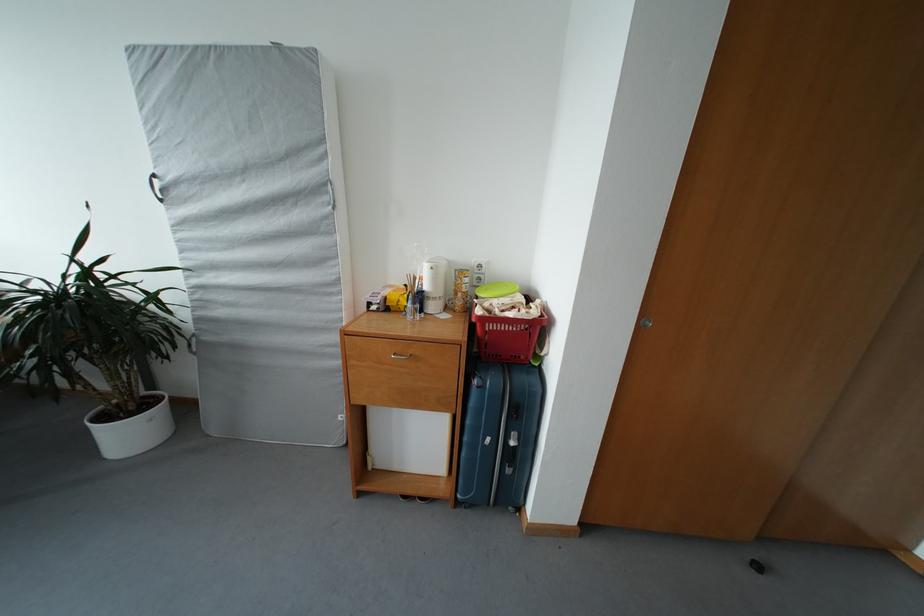
Identify the location of patterned mug handle. This screenshot has width=924, height=616. (464, 290).